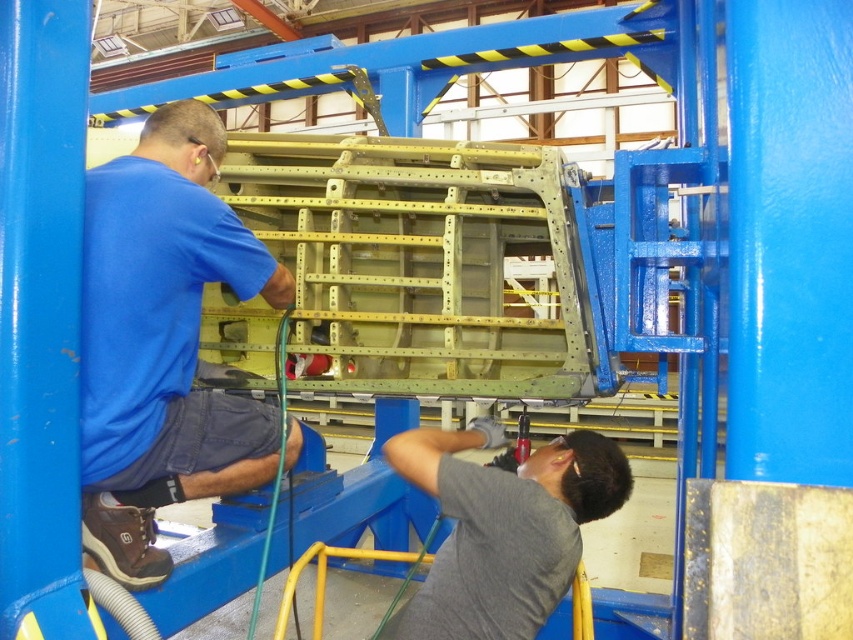
Based on the coordinates provided in the scene description, where is the blue fabric shirt at upper left located in the image?

The blue fabric shirt at upper left is located at the coordinates point (163, 340).

You are an inspector in this industrial facility and need to determine if the blue fabric shirt at upper left and the gray matte shirt at lower center can both fit on a standard hanger that is 30 cm wide. Can they fit together?

The blue fabric shirt at upper left has a lesser width compared to gray matte shirt at lower center. Since the total width of both shirts combined would exceed the 30 cm hanger, they cannot fit together.

You are an inspector in the facility and need to locate the point at coordinates [163,340]. According to the image, where would this point be located?

The point at coordinates [163,340] is on the blue fabric shirt at upper left.